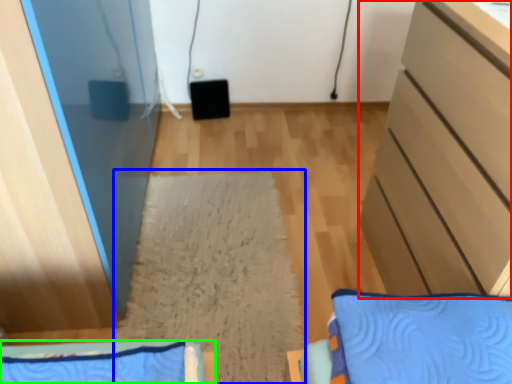
Question: Which is nearer to the cabinetry (highlighted by a red box)? mat (highlighted by a blue box) or furniture (highlighted by a green box).

Choices:
 (A) mat
 (B) furniture

Answer: (A)